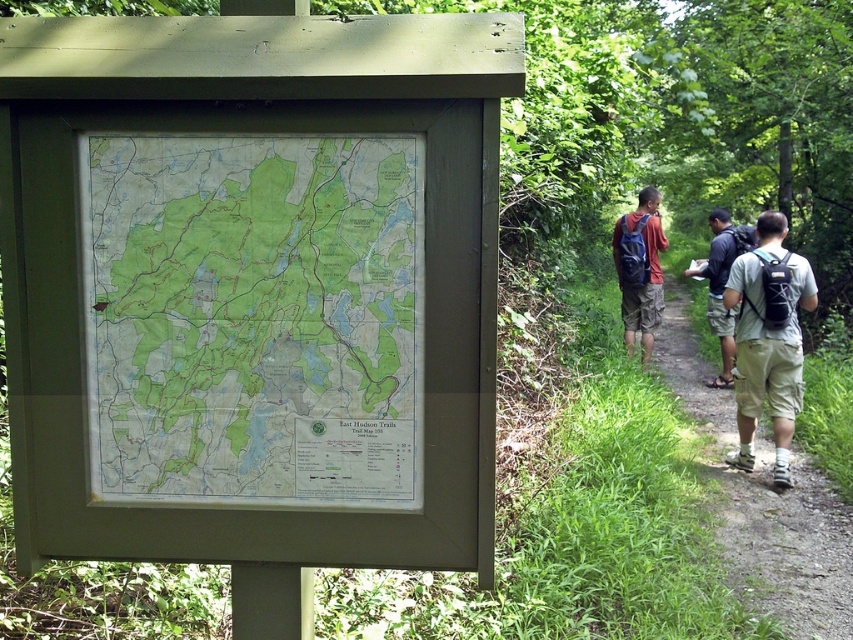
In the scene shown: Which is more to the right, brown dirt path at center or dark gray backpack at center?

dark gray backpack at center is more to the right.

The height and width of the screenshot is (640, 853). Find the location of `brown dirt path at center`. brown dirt path at center is located at coordinates (764, 500).

Locate an element on the screen. brown dirt path at center is located at coordinates (764, 500).

Does green paper map at center have a greater width compared to blue backpack at center?

Correct, the width of green paper map at center exceeds that of blue backpack at center.

Is the position of green paper map at center less distant than that of blue backpack at center?

That is True.

Image resolution: width=853 pixels, height=640 pixels. I want to click on green paper map at center, so click(x=254, y=320).

Is brown dirt path at center wider than khaki cotton shorts at right?

Indeed, brown dirt path at center has a greater width compared to khaki cotton shorts at right.

How much distance is there between brown dirt path at center and khaki cotton shorts at right?

brown dirt path at center is 3.67 feet from khaki cotton shorts at right.

Is point (782, 618) in front of point (741, 300)?

Yes, it is in front of point (741, 300).

Identify the location of brown dirt path at center. This screenshot has width=853, height=640. (764, 500).